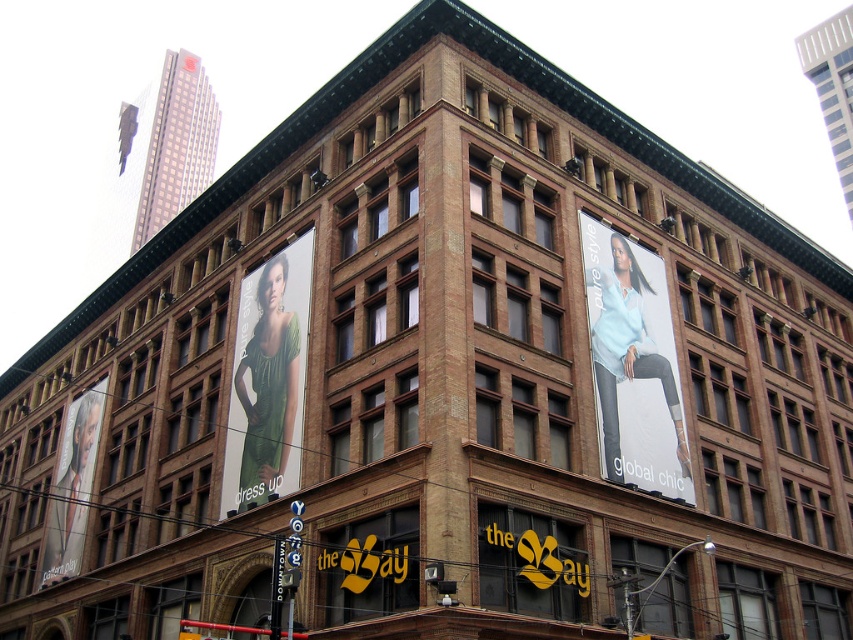
You are an interior designer who needs to place a 10 feet long sofa between the light blue fabric at upper right and the green fabric dress at left. Can you fit the sofa in the space between them?

The distance between the light blue fabric at upper right and the green fabric dress at left is 64.83 feet, which is more than enough to fit a 10 feet long sofa between them.

You are an architect analyzing the building facade. You notice the light blue fabric at upper right and the matte black portrait at left. Which object is positioned more to the east side of the building?

The light blue fabric at upper right is positioned more to the east side of the building because it is to the right of the matte black portrait at left.